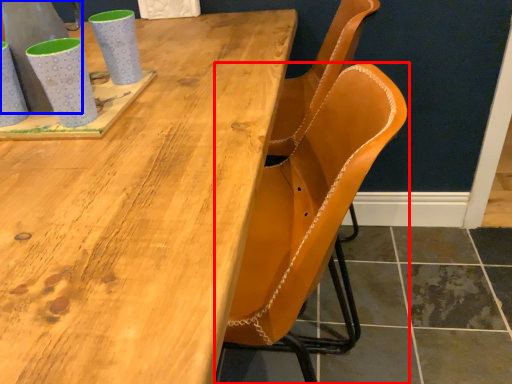
Question: Which of the following is the farthest to the observer, chair (highlighted by a red box) or gray (highlighted by a blue box)?

Choices:
 (A) chair
 (B) gray

Answer: (A)